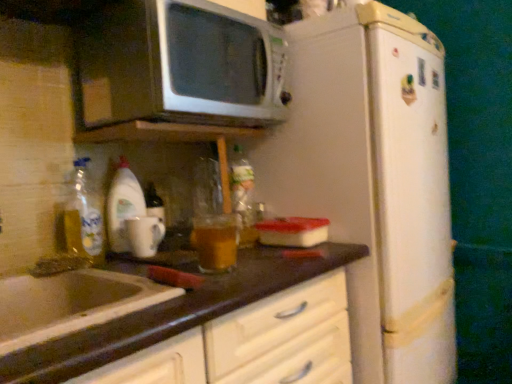
Identify the location of free spot in front of white glossy mug at left. (132, 266).